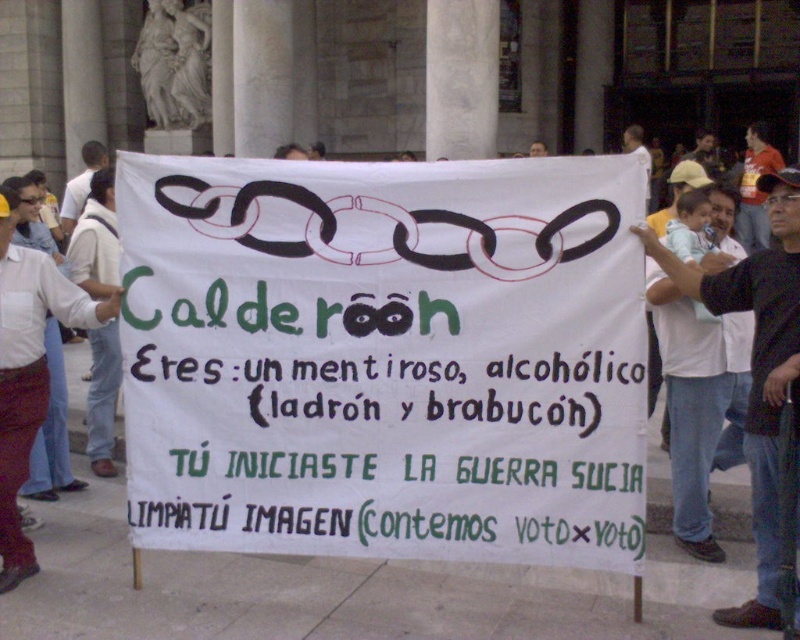
Question: Can you confirm if black shirt at upper right is wider than white cotton shirt at left?

Choices:
 (A) yes
 (B) no

Answer: (A)

Question: Among these points, which one is nearest to the camera?

Choices:
 (A) (716, 170)
 (B) (66, 221)

Answer: (B)

Question: Among these objects, which one is farthest from the camera?

Choices:
 (A) white shirt at center
 (B) white paper banner at center

Answer: (A)

Question: Is black shirt at upper right below light brown leather cap at upper right?

Choices:
 (A) yes
 (B) no

Answer: (A)

Question: Is white paper banner at center wider than light brown leather cap at upper right?

Choices:
 (A) no
 (B) yes

Answer: (B)

Question: Which object is the closest to the white shirt at upper left?

Choices:
 (A) white cotton shirt at left
 (B) black shirt at upper right
 (C) white shirt at center
 (D) white paper banner at center

Answer: (A)